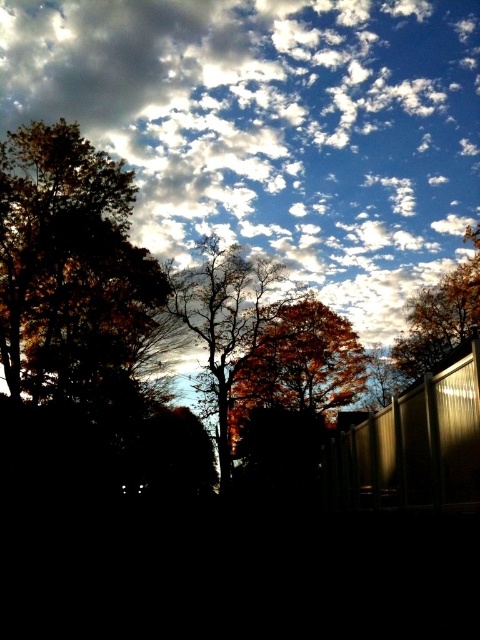
You are standing in the outdoor scene and want to walk towards the point at coordinates (x=477, y=330). However, there is an obstacle at point (x=358, y=497). Will you encounter this obstacle before reaching your destination?

Yes, you will encounter the obstacle at point (x=358, y=497) before reaching point (x=477, y=330) because point (x=358, y=497) is in front of point (x=477, y=330).

You are standing at the center of the image and want to walk towards the metallic corrugated fence at lower right. Which direction should you move in to reach it?

The metallic corrugated fence at lower right is located at point (411, 448), so you should move towards the lower right direction to reach it.

You are standing in the scene and want to walk from the orange leafy tree at upper right to the metallic corrugated fence at lower right. Which direction should you move to reach the fence from the tree?

To reach the metallic corrugated fence at lower right from the orange leafy tree at upper right, you should move downward and to the left, as the fence is positioned to the left and lower than the tree.